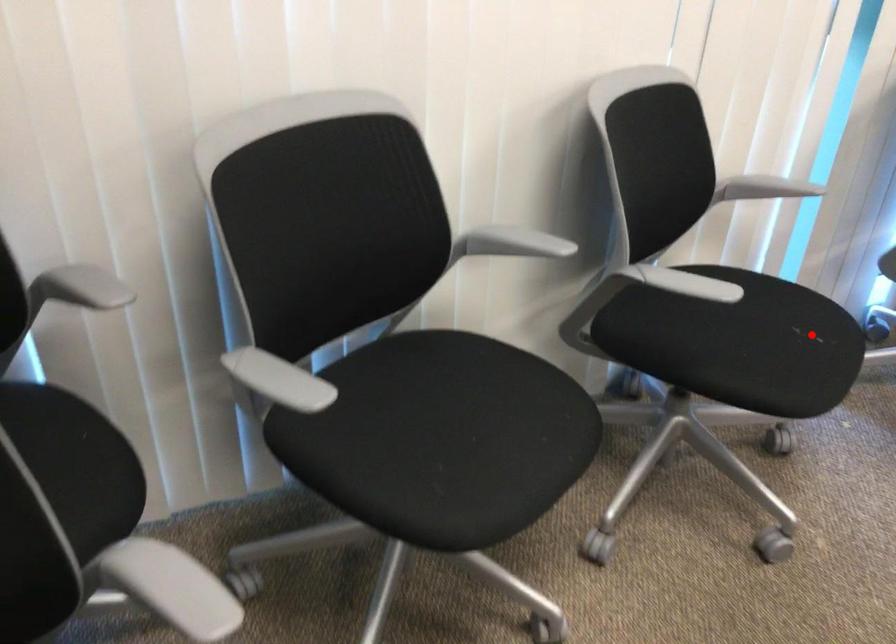
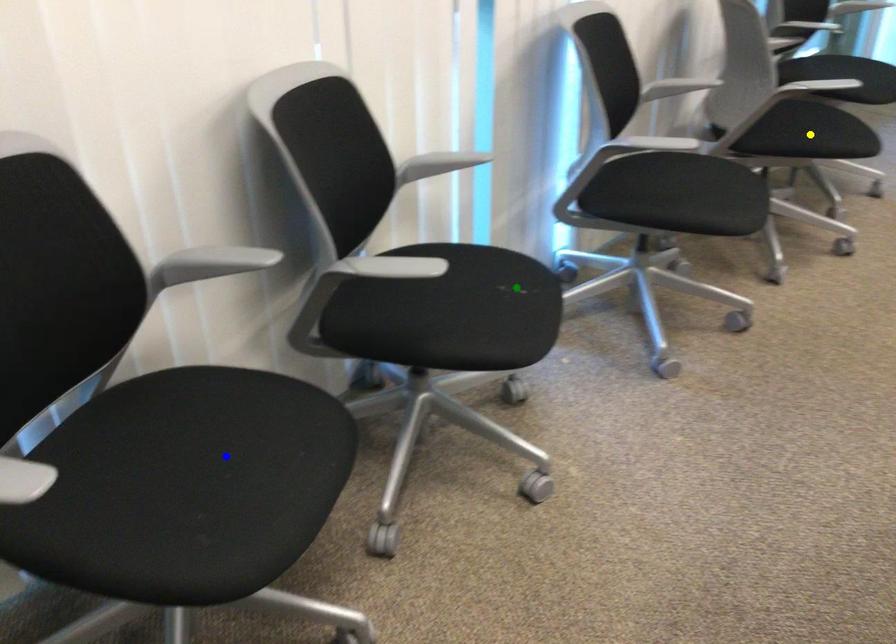
Question: I am providing you with two images of the same scene from different viewpoints. A red point is marked on the first image. You are given multiple points on the second image. Which point in image 2 represents the same 3d spot as the red point in image 1?

Choices:
 (A) green point
 (B) blue point
 (C) yellow point

Answer: (A)